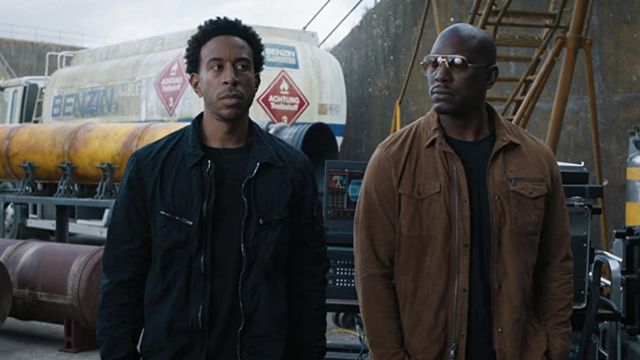
Identify the location of stairs. Image resolution: width=640 pixels, height=360 pixels. (523, 42), (550, 20), (516, 116).